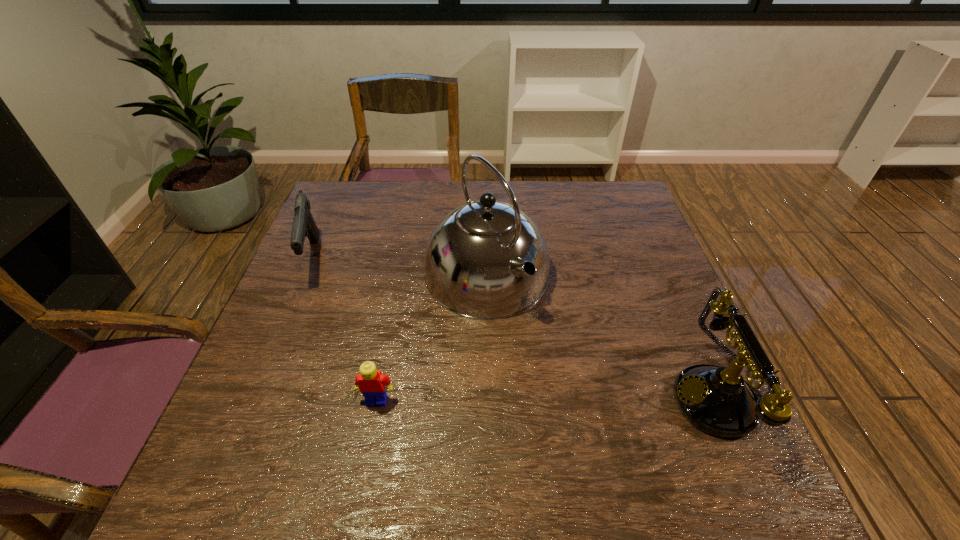
At what (x,y) coordinates should I click in order to perform the action: click on the third object from right to left. Please return your answer as a coordinate pair (x, y). Looking at the image, I should click on (371, 383).

I want to click on the shortest object, so click(371, 383).

In order to click on the rightmost object in this screenshot , I will do `click(717, 400)`.

Find the location of `telephone`. telephone is located at coordinates (717, 400).

Find the location of a particular element. The image size is (960, 540). the tallest object is located at coordinates (487, 259).

You are a GUI agent. You are given a task and a screenshot of the screen. Output one action in this format:
    pyautogui.click(x=<x>, y=<y>)
    Task: Click on the second object from right to left
    
    Given the screenshot: What is the action you would take?
    pyautogui.click(x=487, y=259)

This screenshot has width=960, height=540. Find the location of `gun`. gun is located at coordinates (304, 225).

At what (x,y) coordinates should I click in order to perform the action: click on the leftmost object. Please return your answer as a coordinate pair (x, y). Looking at the image, I should click on (304, 225).

Image resolution: width=960 pixels, height=540 pixels. I want to click on vacant space located 0.060m on the front-facing side of the third object from right to left, so pos(370,436).

What are the coordinates of `free space located on the dial of the rightmost object` in the screenshot? It's located at (497, 398).